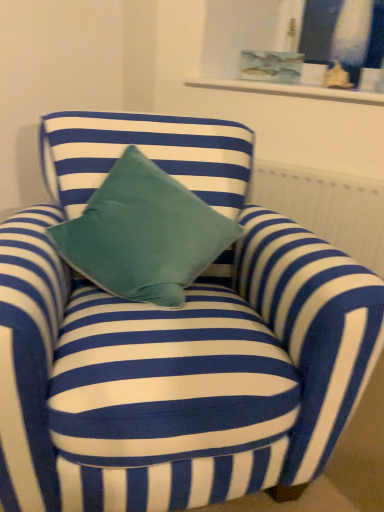
Question: From a real-world perspective, relative to matte glass vase at upper right, is white textured radiator at upper center vertically above or below?

Choices:
 (A) above
 (B) below

Answer: (B)

Question: In terms of width, does white textured radiator at upper center look wider or thinner when compared to matte glass vase at upper right?

Choices:
 (A) thin
 (B) wide

Answer: (B)

Question: From the image's perspective, is white textured radiator at upper center above or below matte glass vase at upper right?

Choices:
 (A) below
 (B) above

Answer: (A)

Question: Visually, is matte glass vase at upper right positioned to the left or to the right of white textured radiator at upper center?

Choices:
 (A) right
 (B) left

Answer: (A)

Question: From the image's perspective, is matte glass vase at upper right above or below white textured radiator at upper center?

Choices:
 (A) below
 (B) above

Answer: (B)

Question: Looking at the image, does matte glass vase at upper right seem bigger or smaller compared to white textured radiator at upper center?

Choices:
 (A) big
 (B) small

Answer: (B)

Question: In terms of height, does matte glass vase at upper right look taller or shorter compared to white textured radiator at upper center?

Choices:
 (A) short
 (B) tall

Answer: (A)